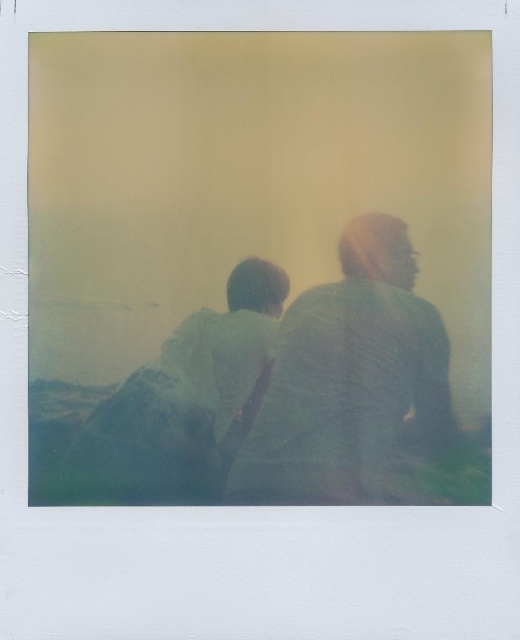
Based on the scene described, which object in the image is wider, the textured gray shirt at center or the green fabric shirt at left?

The textured gray shirt at center is wider than the green fabric shirt at left according to the description.

You are looking at a Polaroid photo and notice two shirts in the scene. The textured gray shirt at center and the green fabric shirt at left. Which shirt is positioned higher in the photo?

The textured gray shirt at center is positioned higher in the photo than the green fabric shirt at left.

You are examining a Polaroid photograph and notice the textured gray shirt at center. Can you determine its exact position in the image using the coordinate system provided?

The textured gray shirt at center is located at point [347,380] in the image coordinate system.